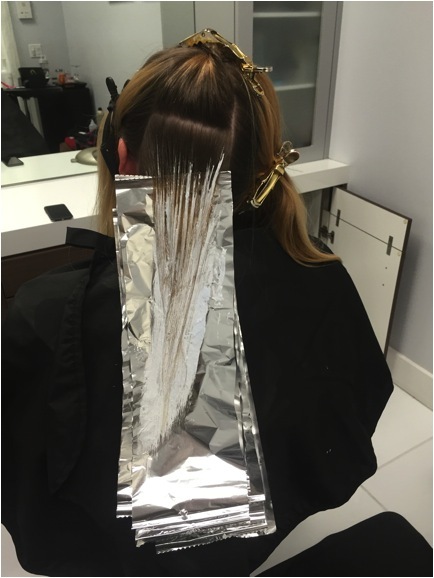
Where is `phone`? This screenshot has height=578, width=434. phone is located at coordinates (57, 213).